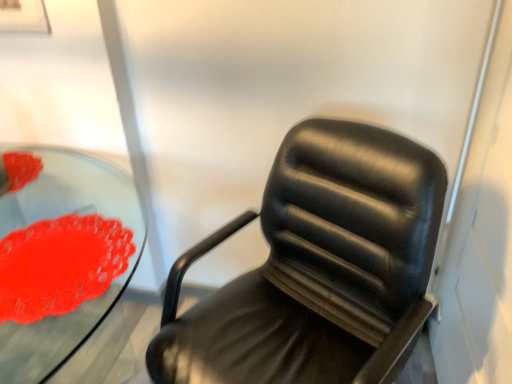
Question: Can we say transparent glass table at center lies outside rubberized red flower at left?

Choices:
 (A) yes
 (B) no

Answer: (A)

Question: Can you confirm if transparent glass table at center is positioned to the right of rubberized red flower at left?

Choices:
 (A) yes
 (B) no

Answer: (B)

Question: Would you say transparent glass table at center contains rubberized red flower at left?

Choices:
 (A) yes
 (B) no

Answer: (A)

Question: From a real-world perspective, is transparent glass table at center physically above rubberized red flower at left?

Choices:
 (A) no
 (B) yes

Answer: (A)

Question: Can you see transparent glass table at center touching rubberized red flower at left?

Choices:
 (A) no
 (B) yes

Answer: (A)

Question: Is transparent glass table at center taller than rubberized red flower at left?

Choices:
 (A) yes
 (B) no

Answer: (A)

Question: Is rubberized red flower at left oriented towards transparent glass table at center?

Choices:
 (A) yes
 (B) no

Answer: (A)

Question: Is rubberized red flower at left outside transparent glass table at center?

Choices:
 (A) no
 (B) yes

Answer: (A)

Question: Considering the relative sizes of rubberized red flower at left and transparent glass table at center in the image provided, is rubberized red flower at left smaller than transparent glass table at center?

Choices:
 (A) no
 (B) yes

Answer: (B)

Question: Considering the relative sizes of rubberized red flower at left and transparent glass table at center in the image provided, is rubberized red flower at left wider than transparent glass table at center?

Choices:
 (A) no
 (B) yes

Answer: (A)

Question: From the image's perspective, does rubberized red flower at left appear lower than transparent glass table at center?

Choices:
 (A) no
 (B) yes

Answer: (A)

Question: Can you confirm if rubberized red flower at left is shorter than transparent glass table at center?

Choices:
 (A) no
 (B) yes

Answer: (B)

Question: Considering the relative sizes of black leather chair at center and transparent glass table at center in the image provided, is black leather chair at center smaller than transparent glass table at center?

Choices:
 (A) no
 (B) yes

Answer: (B)